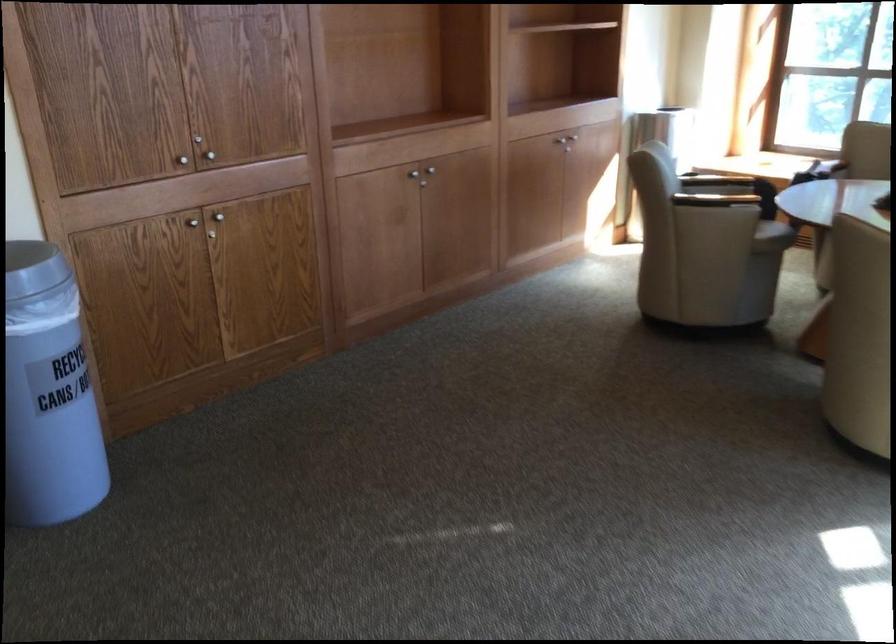
This screenshot has width=896, height=644. I want to click on chair sitting surface, so point(739,225).